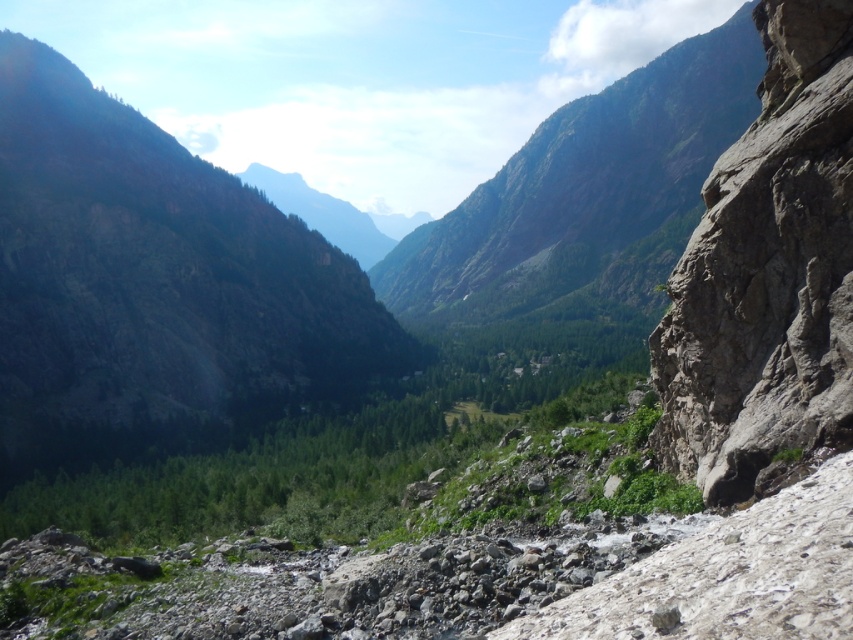
Question: Which point is farther to the camera?

Choices:
 (A) (44, 456)
 (B) (550, 172)

Answer: (B)

Question: Is green rocky mountain at upper left to the left of green rock mountain at center from the viewer's perspective?

Choices:
 (A) yes
 (B) no

Answer: (A)

Question: Is green rocky mountain at upper left in front of green rock mountain at center?

Choices:
 (A) no
 (B) yes

Answer: (B)

Question: Does green rocky mountain at upper left appear under green rock mountain at center?

Choices:
 (A) yes
 (B) no

Answer: (A)

Question: Which object is farther from the camera taking this photo?

Choices:
 (A) green rock mountain at center
 (B) green rocky mountain at upper left

Answer: (A)